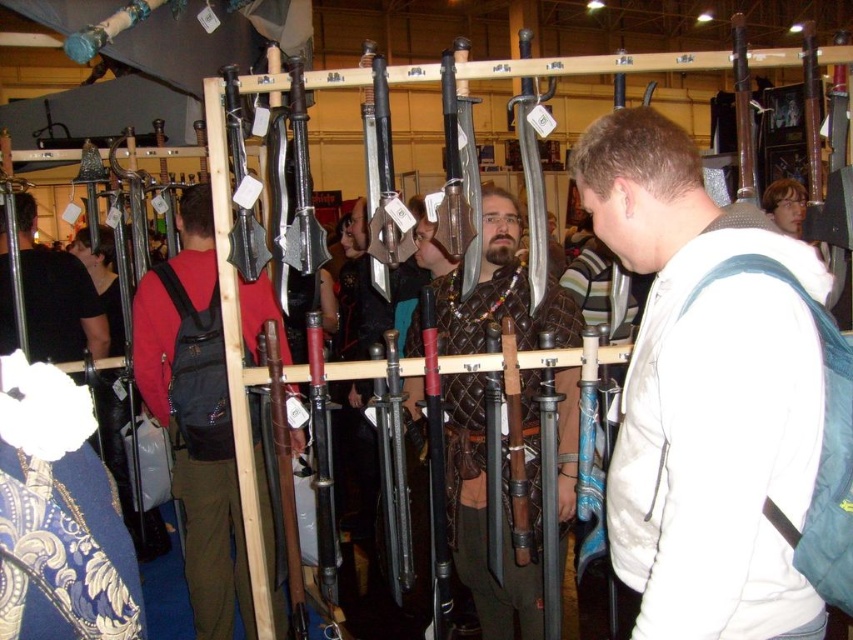
You are organizing a backpack storage area and need to place the dark red backpack at center and the matte black backpack at left. Given their sizes, which backpack should you place on the shelf first to ensure proper stacking?

The dark red backpack at center is larger than the matte black backpack at left, so you should place the dark red backpack at center first on the shelf to ensure proper stacking.

You are at the convention and need to decide which item to take with you next. The dark red backpack at center and the leather armor at center are both in your line of sight. Which one takes up more space?

The dark red backpack at center is bigger than the leather armor at center, so it takes up more space.

You are standing in the convention hall and want to locate the dark red backpack at center. Based on the coordinates provided, which object is located at point (195, 413)?

The dark red backpack at center is located at point (195, 413).